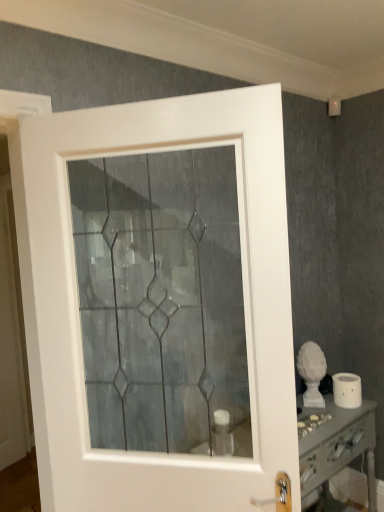
The image size is (384, 512). Describe the element at coordinates (335, 444) in the screenshot. I see `white glossy vanity at lower right` at that location.

What is the approximate width of white glossy vanity at lower right?

white glossy vanity at lower right is 12.21 inches wide.

Measure the distance between point [346,405] and camera.

Point [346,405] is 6.43 feet from camera.

The width and height of the screenshot is (384, 512). Describe the element at coordinates (347, 390) in the screenshot. I see `white matte toilet paper at lower right` at that location.

Identify the location of white glossy door at center. The width and height of the screenshot is (384, 512). (79, 316).

At what (x,y) coordinates should I click in order to perform the action: click on white glossy vanity at lower right. Please return your answer as a coordinate pair (x, y). Looking at the image, I should click on (335, 444).

Which object is further away from the camera taking this photo, white glossy door at center or white matte toilet paper at lower right?

white matte toilet paper at lower right.

Is white glossy door at center turned away from white matte toilet paper at lower right?

Yes, white glossy door at center's orientation is away from white matte toilet paper at lower right.

From a real-world perspective, does white glossy door at center stand above white matte toilet paper at lower right?

Yes.

Identify the location of door located in front of the white matte toilet paper at lower right. (79, 316).

From a real-world perspective, is white glossy vanity at lower right on white matte toilet paper at lower right?

Incorrect, from a real-world perspective, white glossy vanity at lower right is lower than white matte toilet paper at lower right.

Can you confirm if white glossy vanity at lower right is positioned to the left of white matte toilet paper at lower right?

Yes, white glossy vanity at lower right is to the left of white matte toilet paper at lower right.

From the image's perspective, is white glossy vanity at lower right positioned above or below white matte toilet paper at lower right?

Clearly, from the image's perspective, white glossy vanity at lower right is below white matte toilet paper at lower right.

Considering the relative positions of white glossy door at center and white glossy vanity at lower right in the image provided, is white glossy door at center behind white glossy vanity at lower right?

No, it is in front of white glossy vanity at lower right.

Between white glossy door at center and white glossy vanity at lower right, which one appears on the left side from the viewer's perspective?

Positioned to the left is white glossy door at center.

Is the surface of white glossy door at center in direct contact with white glossy vanity at lower right?

No, white glossy door at center is not touching white glossy vanity at lower right.

From the image's perspective, between white matte toilet paper at lower right and white glossy vanity at lower right, who is located below?

From the image's view, white glossy vanity at lower right is below.

Considering the sizes of objects white matte toilet paper at lower right and white glossy vanity at lower right in the image provided, who is smaller, white matte toilet paper at lower right or white glossy vanity at lower right?

white matte toilet paper at lower right.

Looking at this image, is white glossy vanity at lower right a part of white matte toilet paper at lower right?

A: No, white glossy vanity at lower right is located outside of white matte toilet paper at lower right.

Considering the positions of objects white matte toilet paper at lower right and white glossy door at center in the image provided, who is more to the right, white matte toilet paper at lower right or white glossy door at center?

white matte toilet paper at lower right.

How many degrees apart are the facing directions of white matte toilet paper at lower right and white glossy door at center?

The facing directions of white matte toilet paper at lower right and white glossy door at center are 54.1 degrees apart.

Is white matte toilet paper at lower right touching white glossy door at center?

white matte toilet paper at lower right is not next to white glossy door at center, and they're not touching.

Choose the correct answer: Is white matte toilet paper at lower right inside white glossy door at center or outside it?

white matte toilet paper at lower right is located beyond the bounds of white glossy door at center.

Considering the sizes of objects white glossy vanity at lower right and white glossy door at center in the image provided, who is thinner, white glossy vanity at lower right or white glossy door at center?

Thinner between the two is white glossy door at center.

Is white glossy door at center at the back of white glossy vanity at lower right?

No, white glossy vanity at lower right's orientation is not away from white glossy door at center.

Image resolution: width=384 pixels, height=512 pixels. What are the coordinates of `vanity that is under the white glossy door at center (from a real-world perspective)` in the screenshot? It's located at (335, 444).

Between white glossy vanity at lower right and white glossy door at center, which one appears on the left side from the viewer's perspective?

white glossy door at center is more to the left.

Find the location of a particular element. Image resolution: width=384 pixels, height=512 pixels. toilet paper behind the white glossy door at center is located at coordinates (347, 390).

Where is `vanity below the white matte toilet paper at lower right (from the image's perspective)`? This screenshot has height=512, width=384. vanity below the white matte toilet paper at lower right (from the image's perspective) is located at coordinates (335, 444).

From the image, which object appears to be nearer to white glossy door at center, white glossy vanity at lower right or white matte toilet paper at lower right?

white glossy vanity at lower right is positioned closer to the anchor white glossy door at center.

Based on their spatial positions, is white glossy vanity at lower right or white glossy door at center further from white matte toilet paper at lower right?

white glossy door at center.

Considering their positions, is white glossy door at center positioned further to white glossy vanity at lower right than white matte toilet paper at lower right?

white glossy door at center is positioned further to the anchor white glossy vanity at lower right.

Looking at the image, which one is located closer to white matte toilet paper at lower right, white glossy door at center or white glossy vanity at lower right?

white glossy vanity at lower right is positioned closer to the anchor white matte toilet paper at lower right.

When comparing their distances from white glossy vanity at lower right, does white matte toilet paper at lower right or white glossy door at center seem closer?

white matte toilet paper at lower right lies closer to white glossy vanity at lower right than the other object.

Which object lies further to the anchor point white glossy door at center, white matte toilet paper at lower right or white glossy vanity at lower right?

white matte toilet paper at lower right is further to white glossy door at center.

The image size is (384, 512). Find the location of `vanity located between white glossy door at center and white matte toilet paper at lower right in the depth direction`. vanity located between white glossy door at center and white matte toilet paper at lower right in the depth direction is located at coordinates (335, 444).